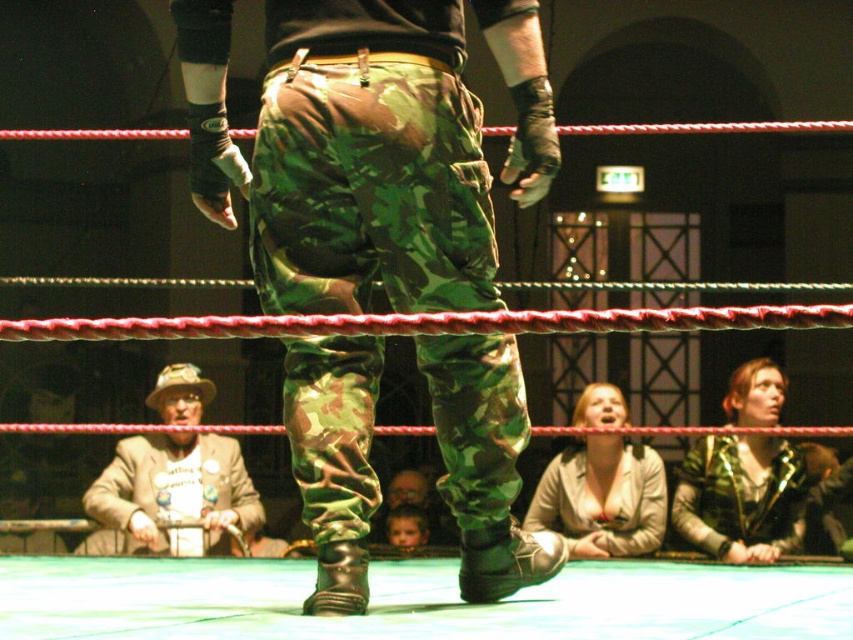
Consider the image. Which of these two, light brown leather jacket at lower left or leather jacket at lower center, stands shorter?

leather jacket at lower center is shorter.

Is light brown leather jacket at lower left in front of leather jacket at lower center?

Yes.

Find the location of a particular element. light brown leather jacket at lower left is located at coordinates (170, 493).

Does camo pants at center have a greater height compared to light brown leather jacket at lower left?

Indeed, camo pants at center has a greater height compared to light brown leather jacket at lower left.

What do you see at coordinates (347, 154) in the screenshot? This screenshot has width=853, height=640. I see `camo pants at center` at bounding box center [347, 154].

Find the location of `camo pants at center`. camo pants at center is located at coordinates (347, 154).

Is camo pants at center positioned behind leather jacket at lower center?

No, camo pants at center is closer to the viewer.

Does camo pants at center appear over leather jacket at lower center?

Yes.

This screenshot has width=853, height=640. What do you see at coordinates (347, 154) in the screenshot?
I see `camo pants at center` at bounding box center [347, 154].

The height and width of the screenshot is (640, 853). What are the coordinates of `camo pants at center` in the screenshot? It's located at (347, 154).